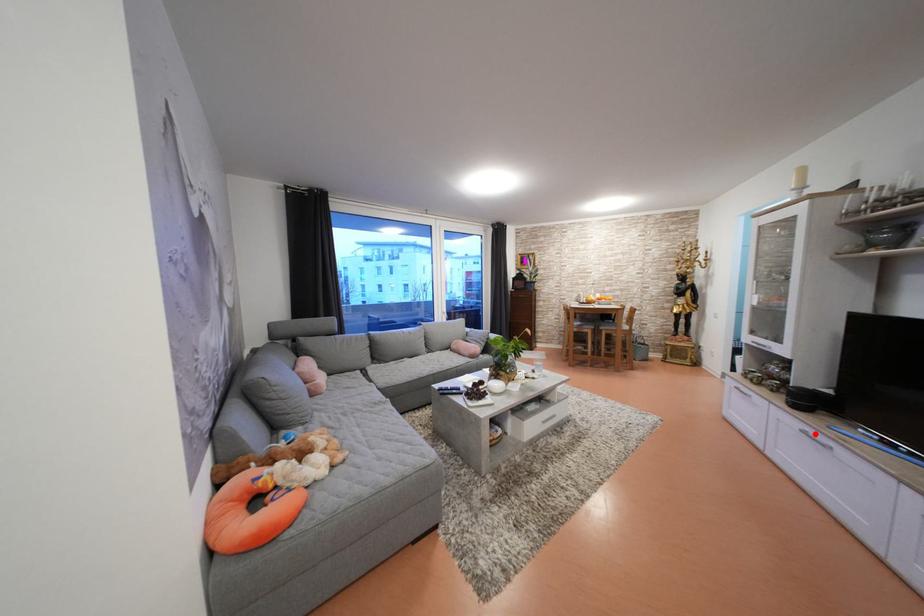
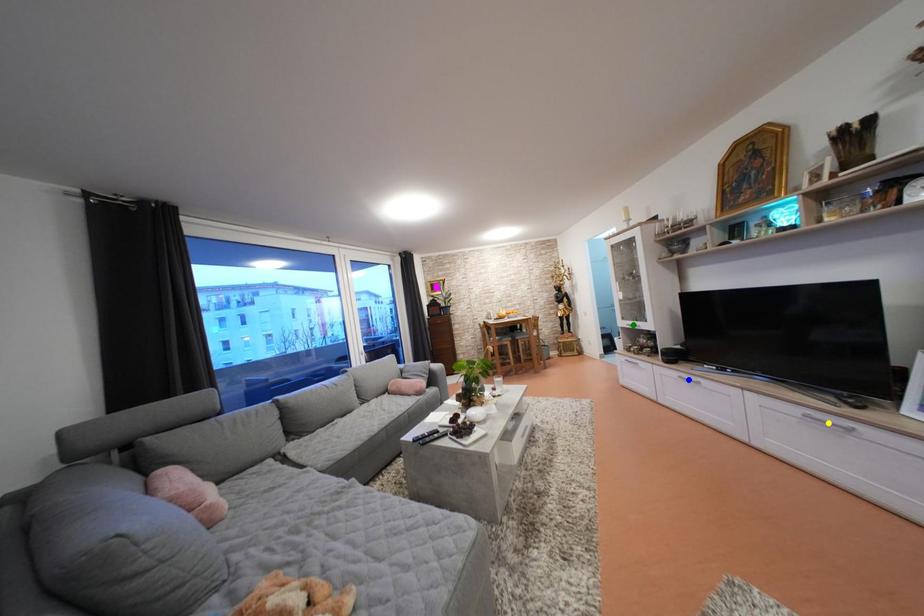
Question: I am providing you with two images of the same scene from different viewpoints. A red point is marked on the first image. You are given multiple points on the second image. In image 2, which mark is for the same physical point as the one in image 1?

Choices:
 (A) yellow point
 (B) blue point
 (C) green point

Answer: (B)